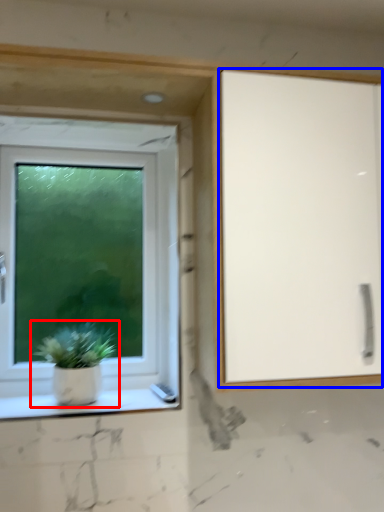
Question: Which point is further to the camera, houseplant (highlighted by a red box) or screen door (highlighted by a blue box)?

Choices:
 (A) houseplant
 (B) screen door

Answer: (A)